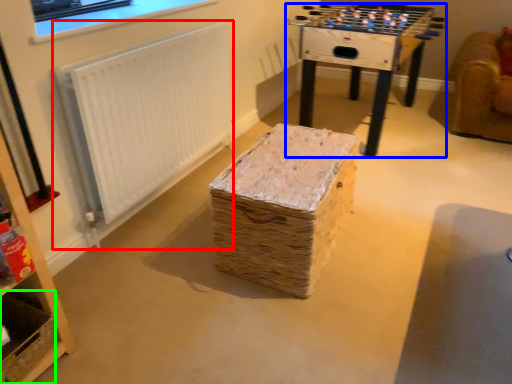
Question: Estimate the real-world distances between objects in this image. Which object is closer to radiator (highlighted by a red box), table (highlighted by a blue box) or basket (highlighted by a green box)?

Choices:
 (A) table
 (B) basket

Answer: (B)